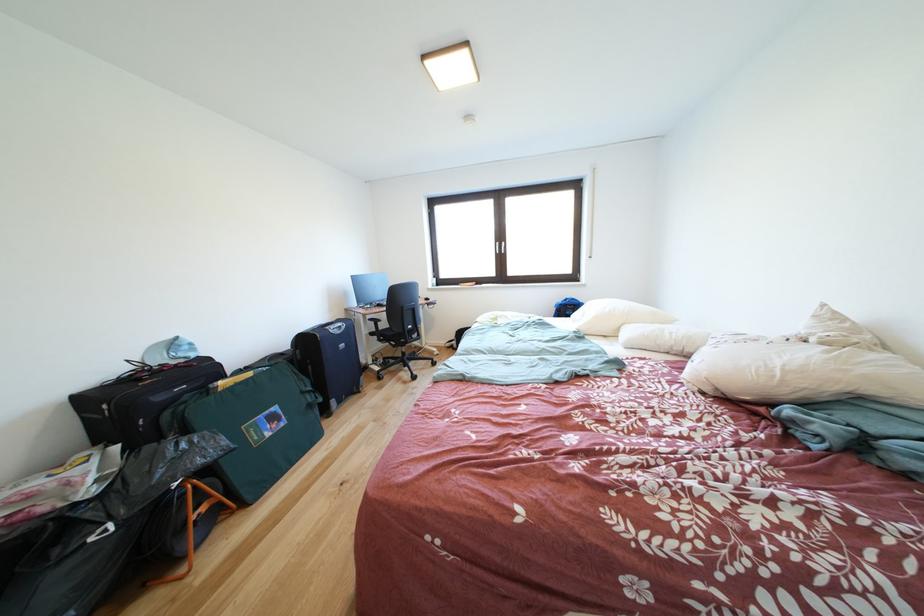
Locate an element on the screen. black chair sitting surface is located at coordinates (399, 326).